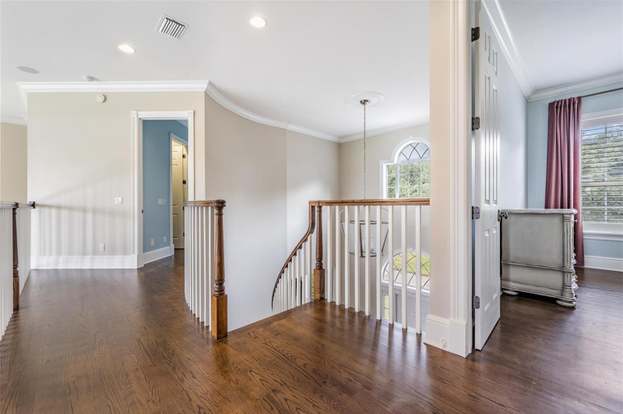
Find the location of a particular element. The height and width of the screenshot is (414, 623). entrance way is located at coordinates (157, 115).